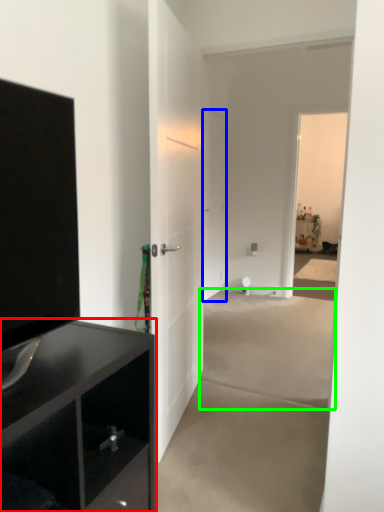
Question: Based on their relative distances, which object is nearer to cabinetry (highlighted by a red box)? Choose from door (highlighted by a blue box) and concrete (highlighted by a green box).

Choices:
 (A) door
 (B) concrete

Answer: (B)